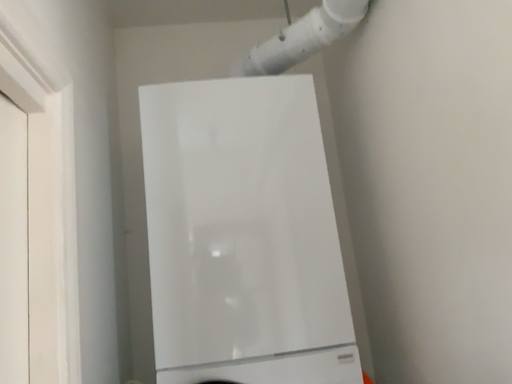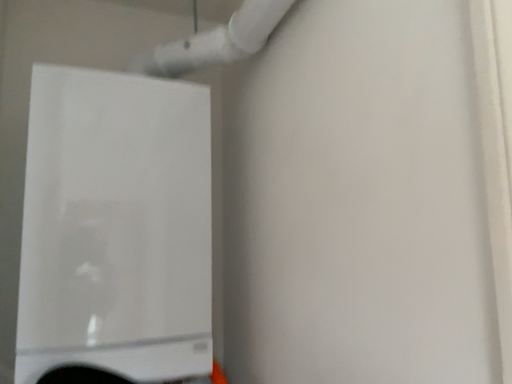
Question: How did the camera likely rotate when shooting the video?

Choices:
 (A) rotated right
 (B) rotated left

Answer: (A)